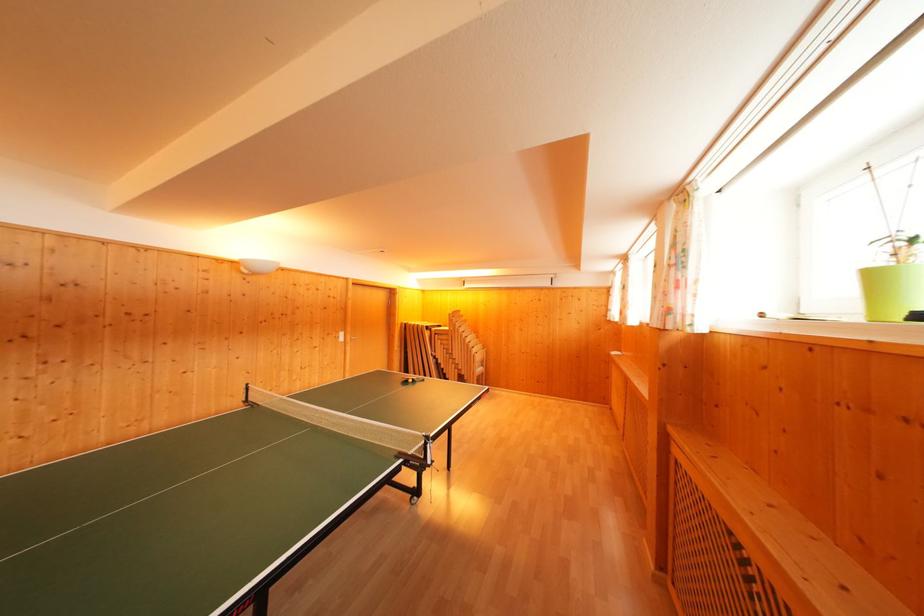
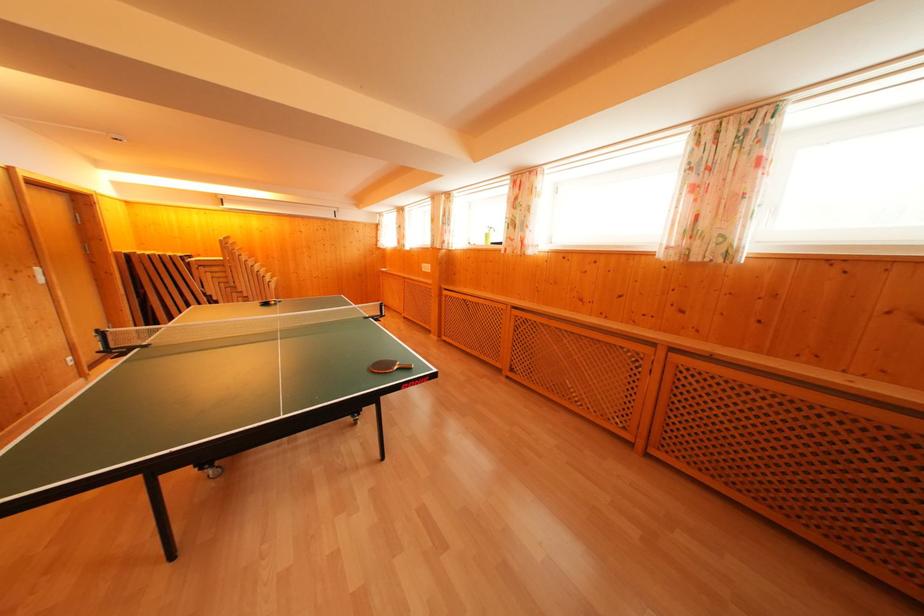
Where in the second image is the point corresponding to pixel 439 362 from the first image?

(210, 300)